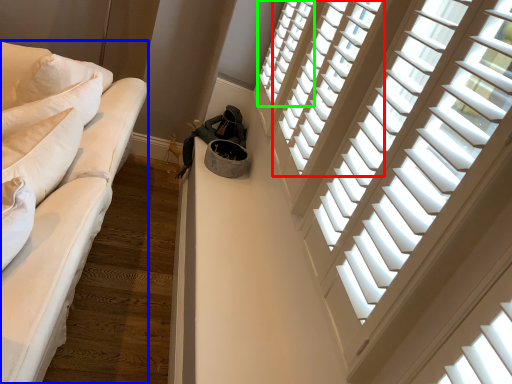
Question: Based on their relative distances, which object is farther from window (highlighted by a red box)? Choose from studio couch (highlighted by a blue box) and window (highlighted by a green box).

Choices:
 (A) studio couch
 (B) window

Answer: (A)